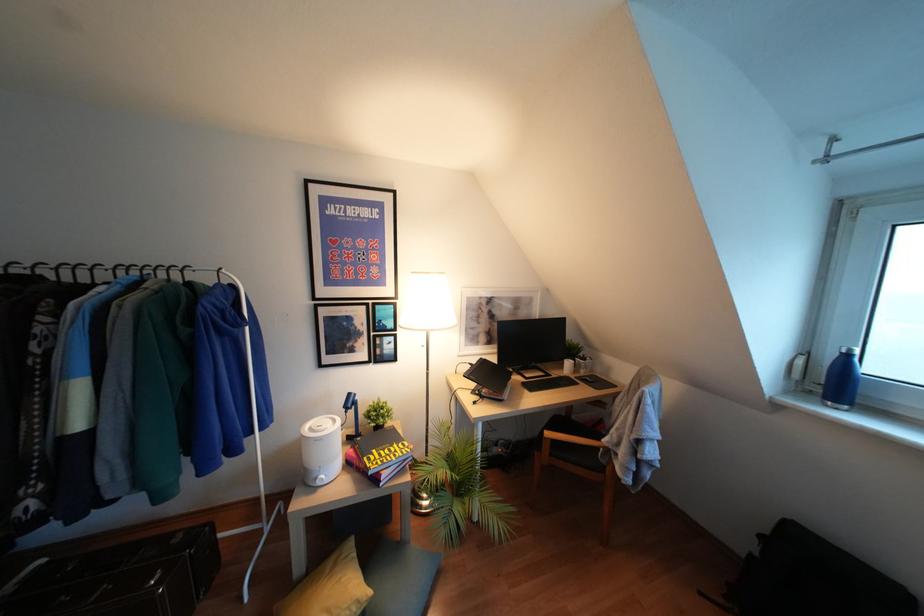
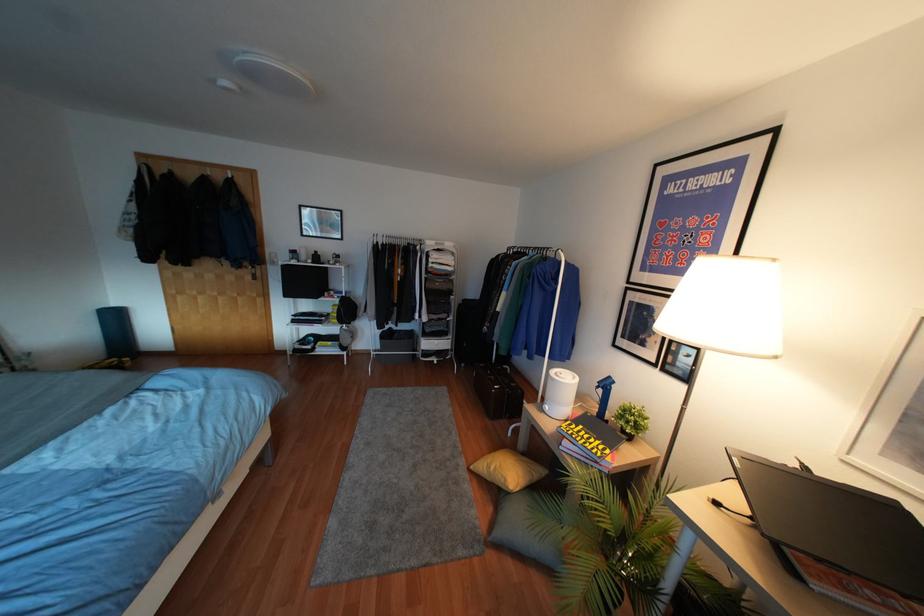
Question: How did the camera likely rotate?

Choices:
 (A) Left
 (B) Right
 (C) Up
 (D) Down

Answer: (A)